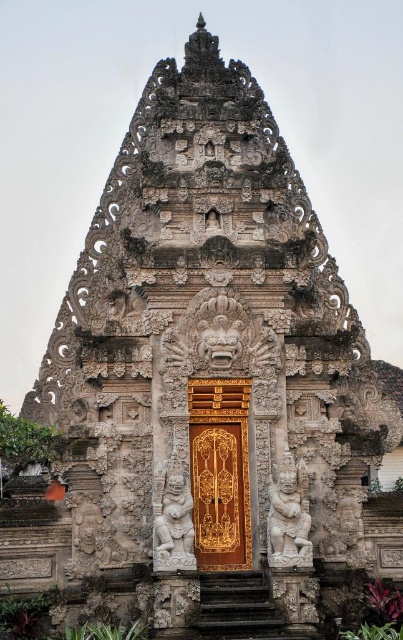
You are standing in front of the temple and want to approach the golden door. According to the image, where are the dark gray stone stairs at center located in relation to the golden door?

The dark gray stone stairs at center lead directly to the golden door, as they are positioned at point (236, 608), which is the central path towards the entrance.

You are an architect designing a new temple inspired by this image. You need to ensure the gold polished wood door at center and the white stone deity at lower center are proportionate. Based on the scene, which object should be made larger in your design?

The gold polished wood door at center should be made larger in your design since it has a larger size compared to the white stone deity at lower center in the original scene.

You are a visitor at the temple and want to reach the golden door. You see the dark gray stone stairs at center and the white stone deity at lower center. Which path is wider for you to walk through?

The dark gray stone stairs at center has a larger width than the white stone deity at lower center, so the path through the dark gray stone stairs at center is wider for you to walk through.